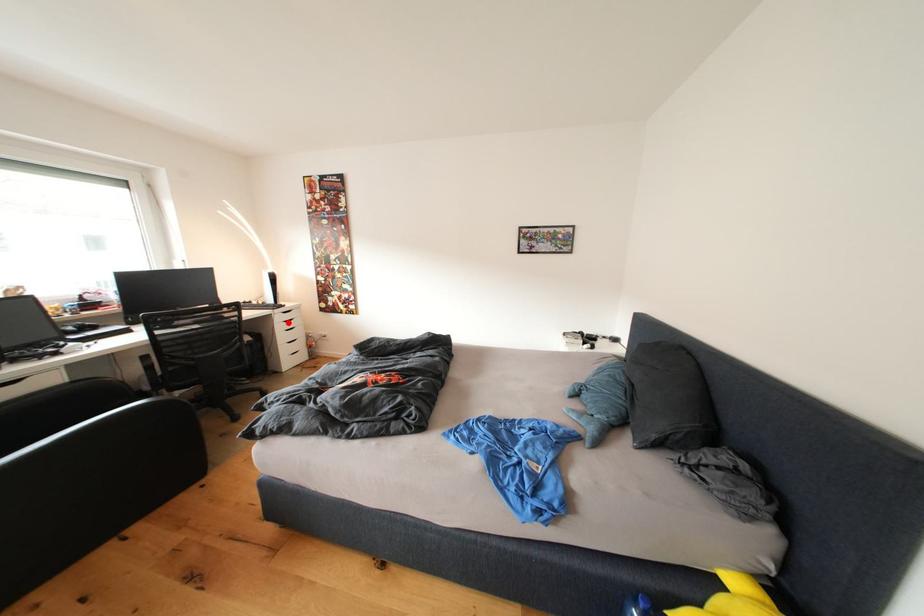
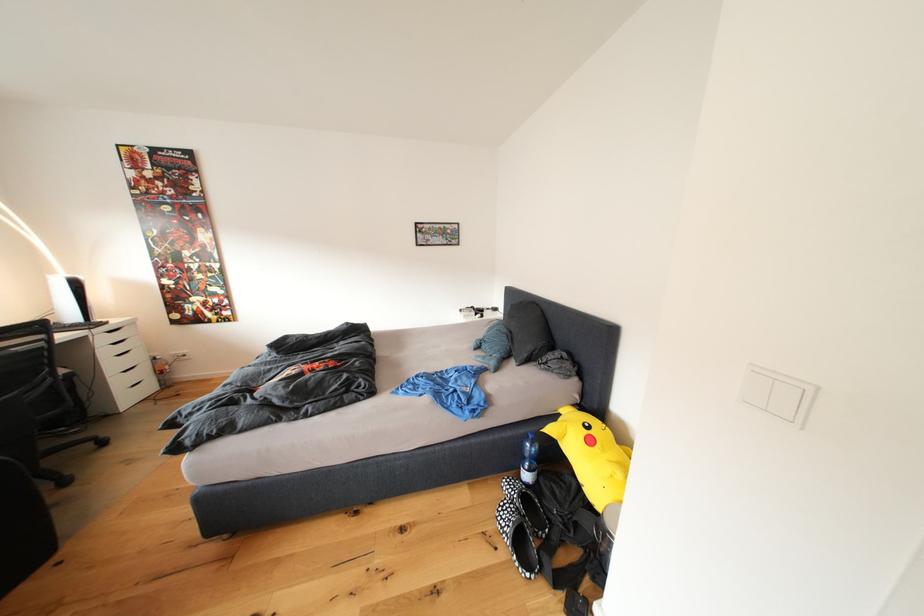
Question: I am providing you with two images of the same scene from different viewpoints. In image1, a red point is highlighted. Considering the same 3D point in image2, which of the following is correct?

Choices:
 (A) It is closer
 (B) It is farther

Answer: (B)